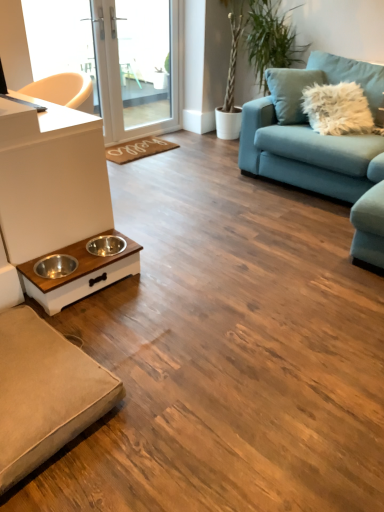
Locate an element on the screen. Image resolution: width=384 pixels, height=512 pixels. vacant space in between white wood pet feeder at lower left and beige fabric studio couch at lower left, which appears as the 1th studio couch when viewed from the front is located at coordinates coord(118,321).